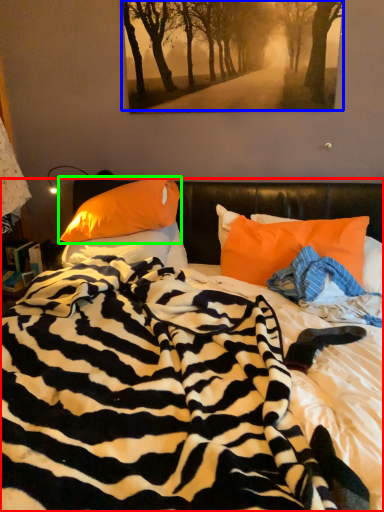
Question: Based on their relative distances, which object is farther from bed (highlighted by a red box)? Choose from tree (highlighted by a blue box) and pillow (highlighted by a green box).

Choices:
 (A) tree
 (B) pillow

Answer: (A)